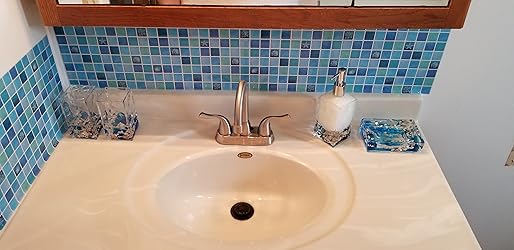
The height and width of the screenshot is (250, 514). I want to click on sink, so click(x=297, y=206).